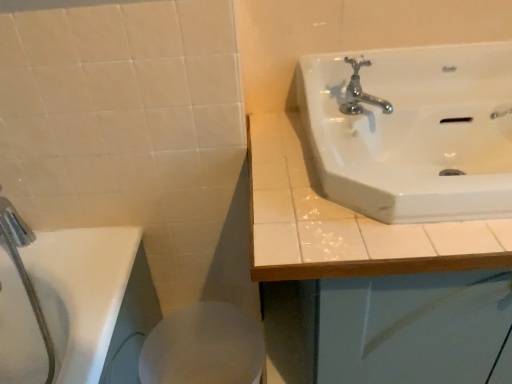
Question: Is white glossy sink at upper right at the back of white glossy sink at upper right?

Choices:
 (A) no
 (B) yes

Answer: (A)

Question: Is white glossy sink at upper right shorter than white glossy sink at upper right?

Choices:
 (A) no
 (B) yes

Answer: (B)

Question: Could you tell me if white glossy sink at upper right is turned towards white glossy sink at upper right?

Choices:
 (A) yes
 (B) no

Answer: (B)

Question: Is the depth of white glossy sink at upper right greater than that of white glossy sink at upper right?

Choices:
 (A) no
 (B) yes

Answer: (A)

Question: Is white glossy sink at upper right bigger than white glossy sink at upper right?

Choices:
 (A) yes
 (B) no

Answer: (B)

Question: From a real-world perspective, is white glossy sink at upper right on top of white glossy sink at upper right?

Choices:
 (A) no
 (B) yes

Answer: (B)

Question: Can you confirm if white glossy bidet at lower center is taller than chrome metallic faucet at upper right?

Choices:
 (A) no
 (B) yes

Answer: (B)

Question: Is white glossy bidet at lower center to the right of chrome metallic faucet at upper right from the viewer's perspective?

Choices:
 (A) yes
 (B) no

Answer: (B)

Question: Is white glossy bidet at lower center positioned far away from chrome metallic faucet at upper right?

Choices:
 (A) yes
 (B) no

Answer: (B)

Question: Considering the relative positions of white glossy bidet at lower center and chrome metallic faucet at upper right in the image provided, is white glossy bidet at lower center to the left of chrome metallic faucet at upper right from the viewer's perspective?

Choices:
 (A) no
 (B) yes

Answer: (B)

Question: From the image's perspective, is white glossy bidet at lower center beneath chrome metallic faucet at upper right?

Choices:
 (A) no
 (B) yes

Answer: (B)

Question: Can you see white glossy bidet at lower center touching chrome metallic faucet at upper right?

Choices:
 (A) yes
 (B) no

Answer: (B)

Question: Could you tell me if chrome metallic faucet at upper right is facing white glossy bidet at lower center?

Choices:
 (A) yes
 (B) no

Answer: (B)